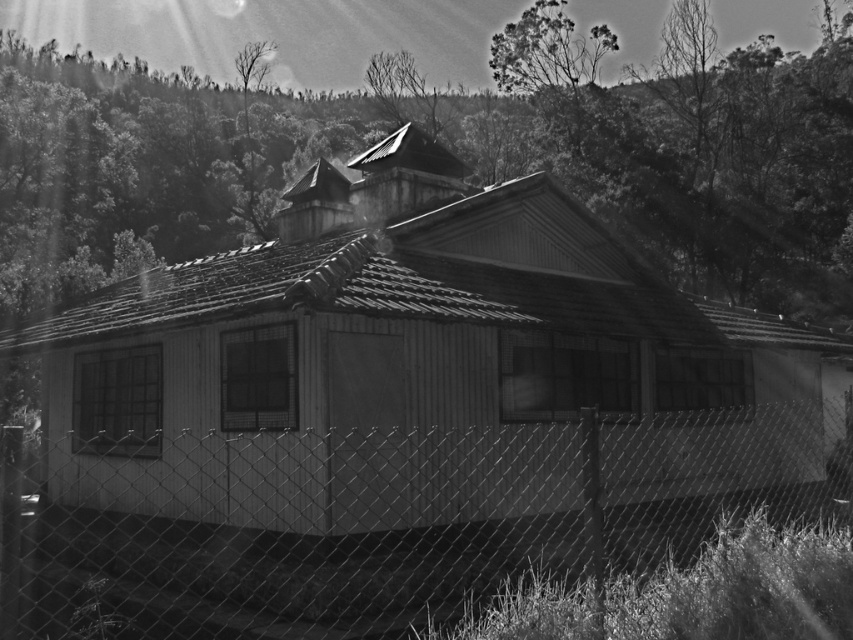
Question: Does wooden hut at center appear under wire mesh fence at lower center?

Choices:
 (A) yes
 (B) no

Answer: (B)

Question: Which point appears closest to the camera in this image?

Choices:
 (A) (564, 426)
 (B) (363, 561)

Answer: (B)

Question: Is wooden hut at center positioned before wire mesh fence at lower center?

Choices:
 (A) yes
 (B) no

Answer: (B)

Question: Which object appears farthest from the camera in this image?

Choices:
 (A) wooden hut at center
 (B) wire mesh fence at lower center

Answer: (A)

Question: Can you confirm if wooden hut at center is smaller than wire mesh fence at lower center?

Choices:
 (A) no
 (B) yes

Answer: (A)